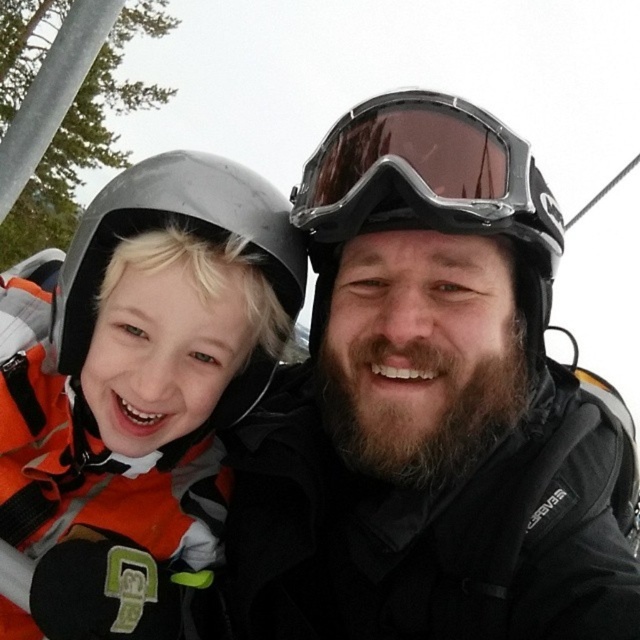
Which is below, matte black helmet at left or transparent plastic goggles at center?

matte black helmet at left is lower down.

Which is behind, point (241, 355) or point (346, 134)?

The point (241, 355) is behind.

Is point (3, 416) in front of point (397, 173)?

No, (3, 416) is behind (397, 173).

Image resolution: width=640 pixels, height=640 pixels. In order to click on matte black helmet at left in this screenshot , I will do `click(141, 355)`.

This screenshot has width=640, height=640. Describe the element at coordinates (428, 406) in the screenshot. I see `black matte helmet at upper center` at that location.

In the scene shown: Does black matte helmet at upper center have a lesser height compared to transparent plastic goggles at center?

In fact, black matte helmet at upper center may be taller than transparent plastic goggles at center.

Find the location of `black matte helmet at upper center`. black matte helmet at upper center is located at coordinates (428, 406).

This screenshot has width=640, height=640. Find the location of `black matte helmet at upper center`. black matte helmet at upper center is located at coordinates (428, 406).

Is black matte helmet at upper center smaller than matte black helmet at left?

Actually, black matte helmet at upper center might be larger than matte black helmet at left.

Looking at this image, measure the distance between black matte helmet at upper center and camera.

A distance of 37.12 inches exists between black matte helmet at upper center and camera.

Find the location of `black matte helmet at upper center`. black matte helmet at upper center is located at coordinates (428, 406).